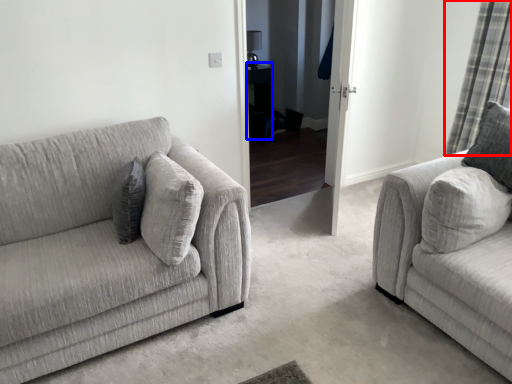
Question: Among these objects, which one is nearest to the camera, curtain (highlighted by a red box) or table (highlighted by a blue box)?

Choices:
 (A) curtain
 (B) table

Answer: (A)